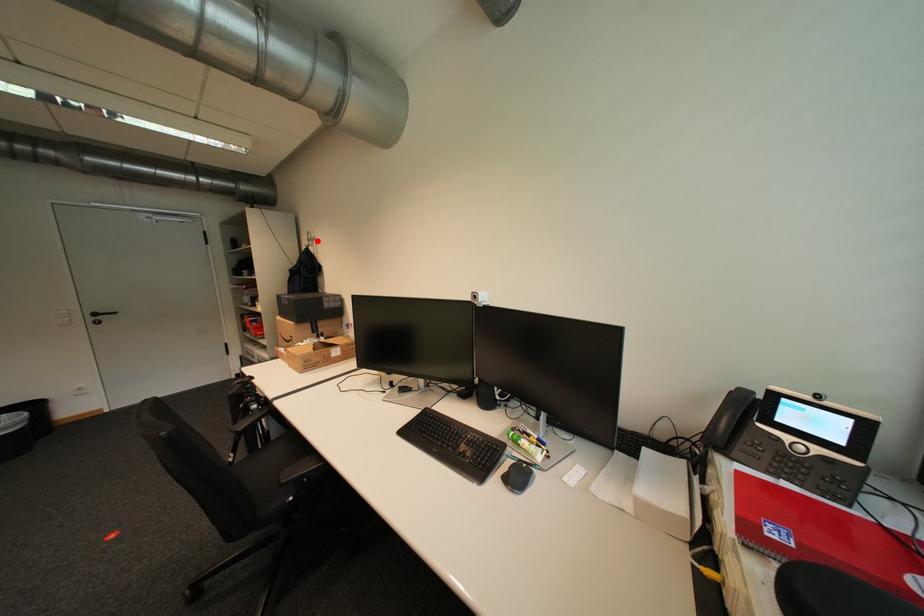
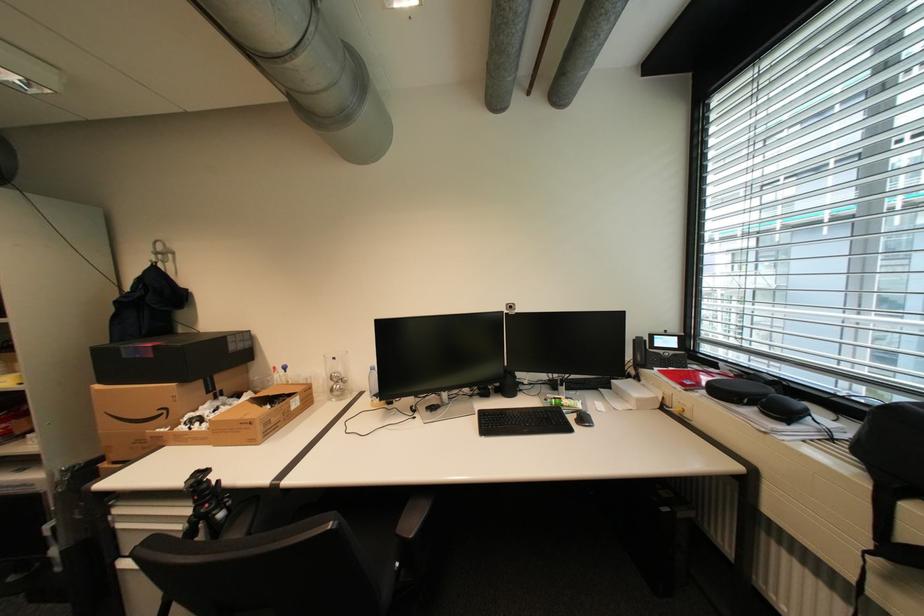
Question: I am providing you with two images of the same scene from different viewpoints. Given a red point in image1, look at the same physical point in image2. Is it:

Choices:
 (A) Closer to the viewpoint
 (B) Farther from the viewpoint

Answer: (B)